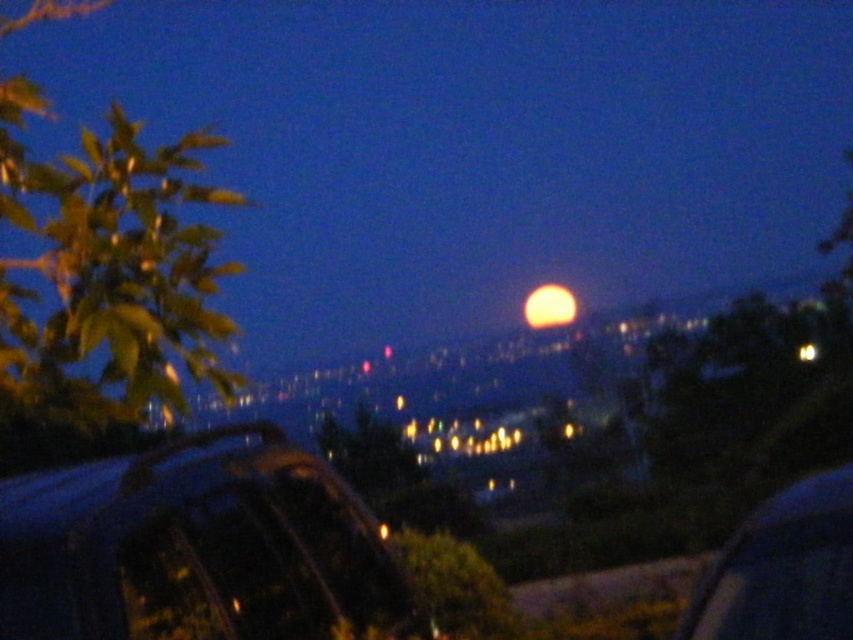
You are standing in the scene and want to take a photo of the green leafy tree at center. Where should you aim your camera to capture it?

You should aim your camera at point coordinates of (454, 586) to capture the green leafy tree at center.

You are a delivery robot with a package that needs to be placed between the shiny black car at lower left and the metallic blue car at lower right. The package requires a space of at least 1.5 meters to fit. Based on the scene, can you determine if there is enough space between the two cars for the package?

The distance between the shiny black car at lower left and the metallic blue car at lower right is 1.41 meters, which is less than the required 1.5 meters. Therefore, there is not enough space to place the package between them.

You are standing in the nighttime scene with the large glowing full moon slightly off to the right. You notice a point at coordinates (454,586). What object is located at this point?

The point at coordinates (454,586) corresponds to the green leafy tree at center.